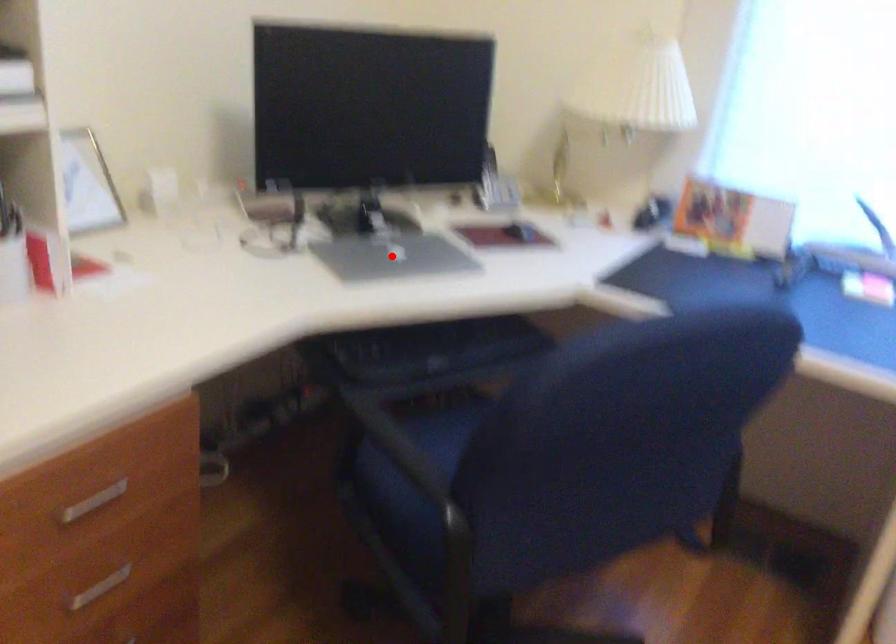
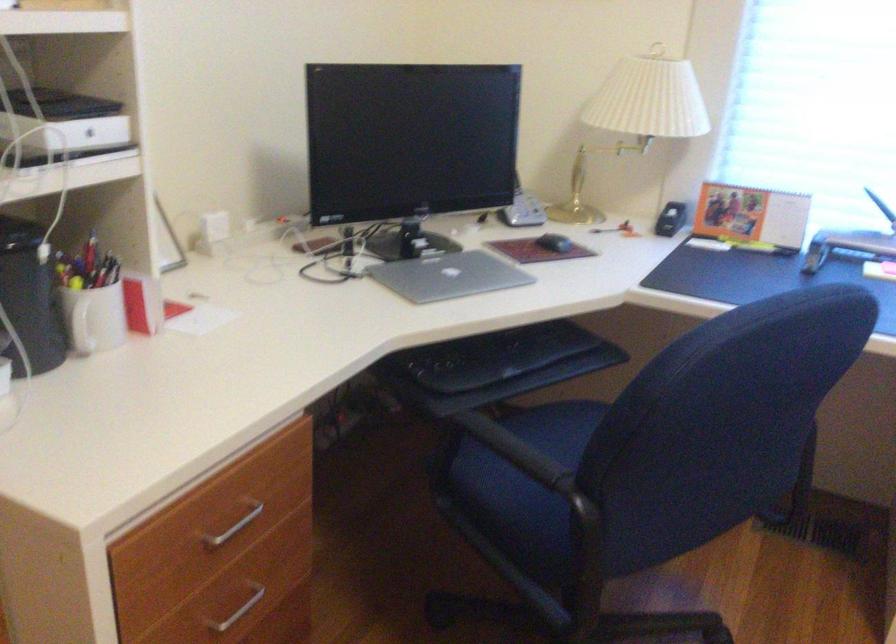
Locate, in the second image, the point that corresponds to the highlighted location in the first image.

(449, 276)